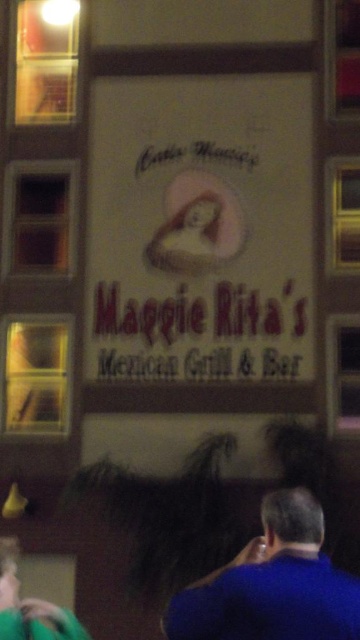
Can you confirm if white paper sign at center is positioned below blue fabric shirt at lower right?

Incorrect, white paper sign at center is not positioned below blue fabric shirt at lower right.

The image size is (360, 640). Describe the element at coordinates (200, 228) in the screenshot. I see `white paper sign at center` at that location.

The width and height of the screenshot is (360, 640). I want to click on white paper sign at center, so click(x=200, y=228).